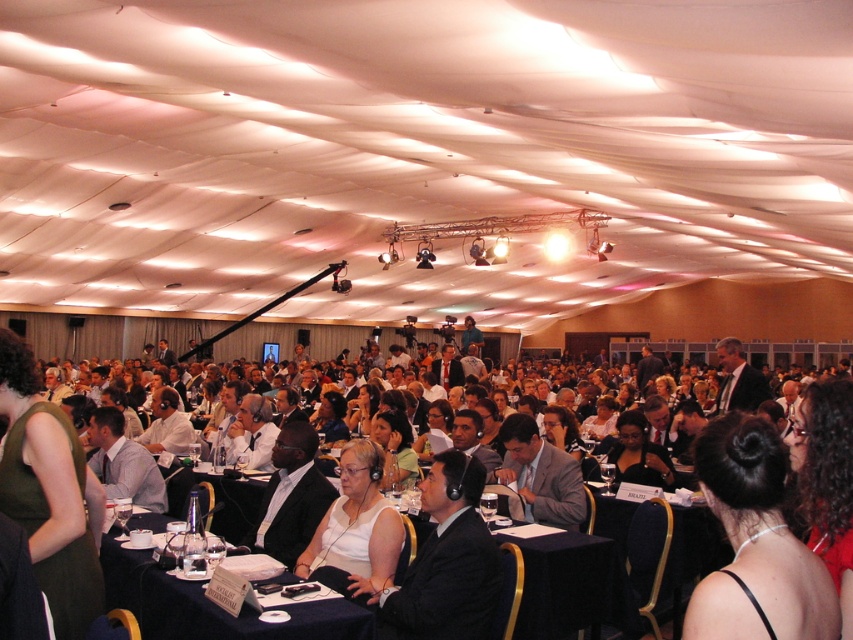
Does point (285, 563) come closer to viewer compared to point (757, 420)?

No, it is not.

How much distance is there between white shirt at center and black satin dress at lower right?

white shirt at center and black satin dress at lower right are 5.81 feet apart from each other.

Is point (3, 468) positioned behind point (749, 492)?

Yes, point (3, 468) is farther from viewer.

At what (x,y) coordinates should I click in order to perform the action: click on white shirt at center. Please return your answer as a coordinate pair (x, y). The height and width of the screenshot is (640, 853). Looking at the image, I should click on (437, 564).

Is black satin dress at lower right further to camera compared to dark blue fabric table at center?

No, black satin dress at lower right is in front of dark blue fabric table at center.

Does black satin dress at lower right appear over dark blue fabric table at center?

Yes, black satin dress at lower right is above dark blue fabric table at center.

The height and width of the screenshot is (640, 853). I want to click on black satin dress at lower right, so click(755, 541).

Locate an element on the screen. The width and height of the screenshot is (853, 640). black satin dress at lower right is located at coordinates (755, 541).

Between point (160, 584) and point (350, 554), which one is positioned in front?

Positioned in front is point (160, 584).

Based on the photo, does dark blue fabric table at center have a larger size compared to white matte shirt at center?

Yes.

Between point (329, 624) and point (386, 566), which one is positioned in front?

Point (329, 624)

Locate an element on the screen. dark blue fabric table at center is located at coordinates (212, 605).